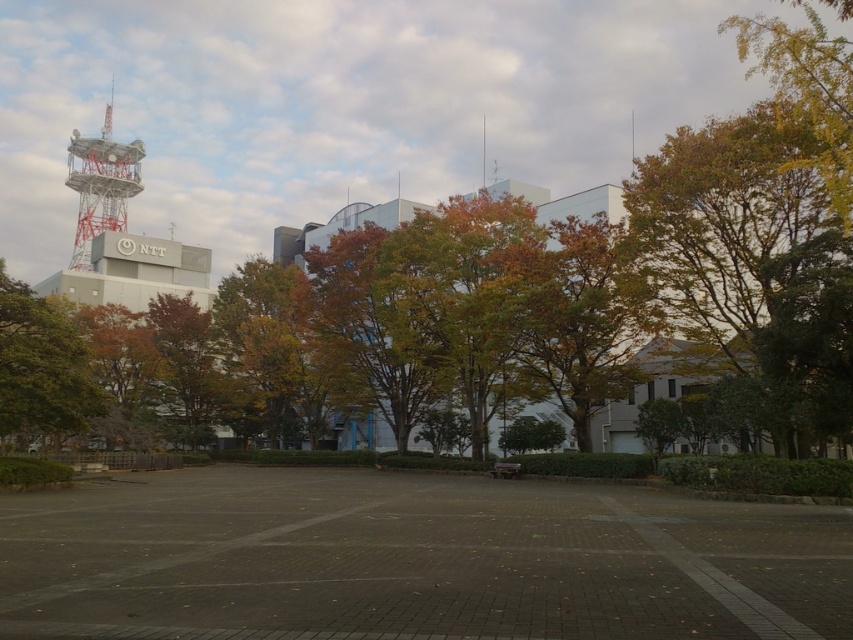
Question: Is yellow-green foliage at right to the right of orange-brown foliage at center from the viewer's perspective?

Choices:
 (A) no
 (B) yes

Answer: (B)

Question: Can you confirm if gray concrete parking lot at center is positioned above metallic lattice tower at upper left?

Choices:
 (A) no
 (B) yes

Answer: (A)

Question: Which object appears farthest from the camera in this image?

Choices:
 (A) metallic lattice tower at upper left
 (B) yellow-green foliage at right
 (C) yellow-green leaves at upper right
 (D) green leafy tree at left

Answer: (A)

Question: Among these points, which one is farthest from the camera?

Choices:
 (A) (653, 618)
 (B) (787, 156)

Answer: (B)

Question: Which point is farther to the camera?

Choices:
 (A) green leafy tree at left
 (B) yellow-green leaves at upper right
 (C) metallic lattice tower at upper left
 (D) gray concrete parking lot at center

Answer: (C)

Question: Is yellow-green leaves at upper right positioned before orange-brown foliage at center?

Choices:
 (A) no
 (B) yes

Answer: (B)